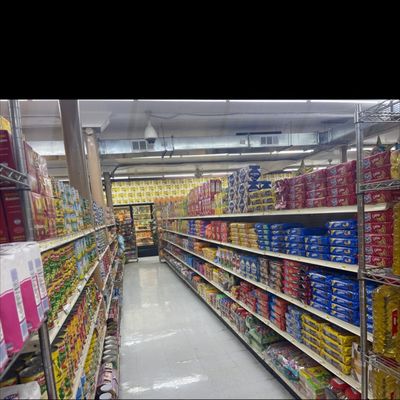
Find the location of a particular element. This screenshot has height=400, width=400. power cord is located at coordinates (214, 114).